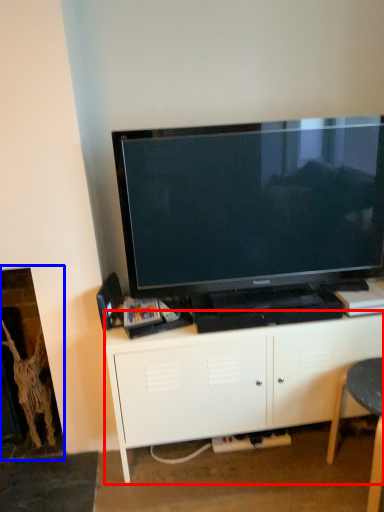
Question: Among these objects, which one is farthest to the camera, cabinetry (highlighted by a red box) or fireplace (highlighted by a blue box)?

Choices:
 (A) cabinetry
 (B) fireplace

Answer: (B)